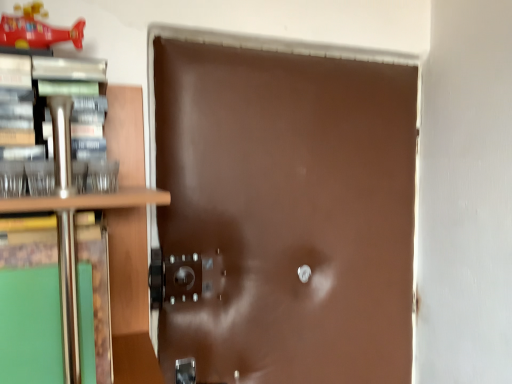
In order to face brown leather door at center, should I rotate leftwards or rightwards?

Turn right approximately 6.795 degrees to face it.

Describe the element at coordinates (288, 212) in the screenshot. I see `brown leather door at center` at that location.

Identify the location of brown leather door at center. (288, 212).

Locate an element on the screen. This screenshot has height=384, width=512. brown leather door at center is located at coordinates (288, 212).